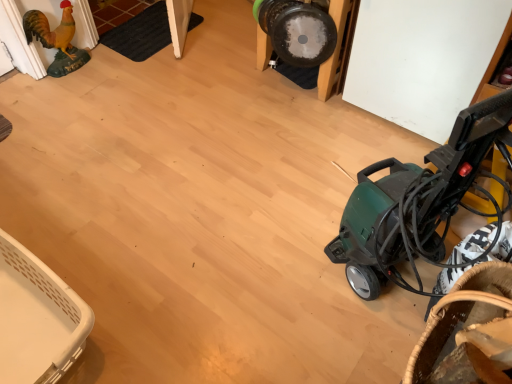
The height and width of the screenshot is (384, 512). What are the coordinates of `free space behind green plastic vacuum cleaner at right` in the screenshot? It's located at (324, 187).